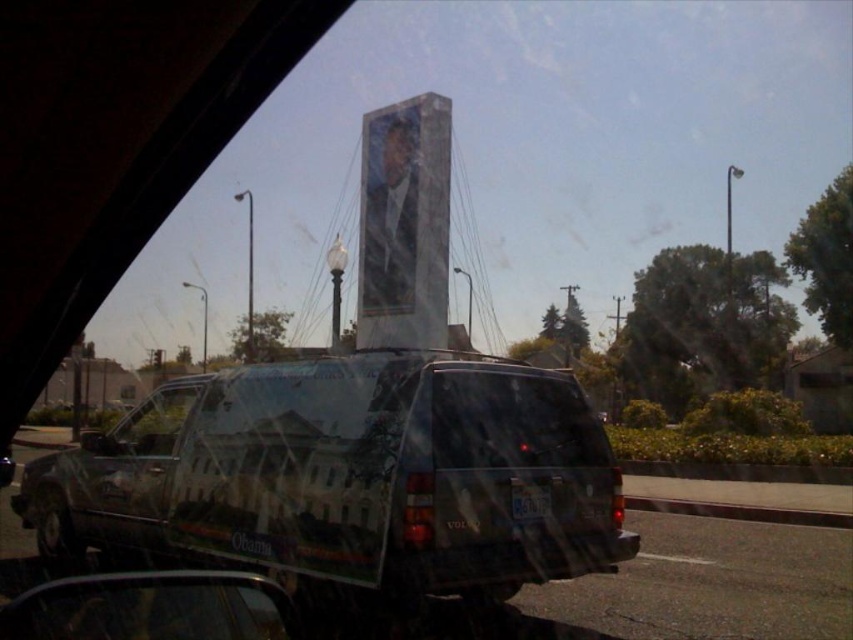
Question: Which point is closer to the camera taking this photo?

Choices:
 (A) (115, 582)
 (B) (103, 444)
 (C) (115, 429)

Answer: (A)

Question: Is transparent glass car window at lower center to the left of metallic reflective view mirror at lower left from the viewer's perspective?

Choices:
 (A) no
 (B) yes

Answer: (A)

Question: Which object is closer to the camera taking this photo?

Choices:
 (A) white plastic license plate at center
 (B) metallic silver suv at center
 (C) transparent plastic car window at center
 (D) transparent glass car window at lower center

Answer: (D)

Question: Does transparent plastic car window at center have a smaller size compared to metallic reflective view mirror at lower left?

Choices:
 (A) no
 (B) yes

Answer: (A)

Question: Which object is positioned closest to the transparent glass car window at lower center?

Choices:
 (A) transparent plastic windshield at center
 (B) metallic silver suv at center
 (C) transparent plastic car window at center
 (D) metallic reflective view mirror at lower left

Answer: (B)

Question: Does metallic silver suv at center appear under transparent plastic car window at center?

Choices:
 (A) yes
 (B) no

Answer: (B)